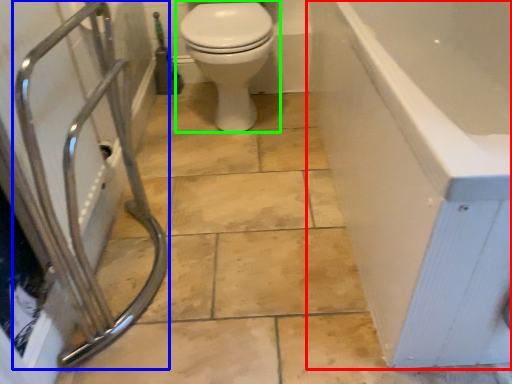
Question: Which object is the closest to the bathtub (highlighted by a red box)? Choose among these: shower (highlighted by a blue box) or toilet (highlighted by a green box).

Choices:
 (A) shower
 (B) toilet

Answer: (B)